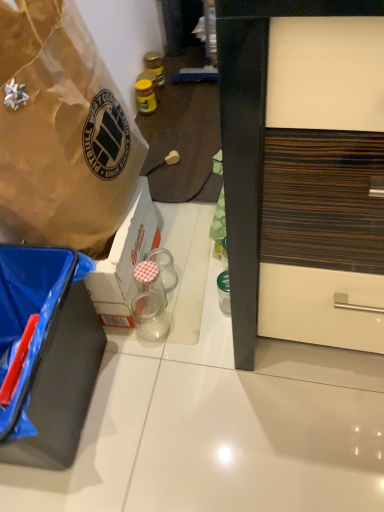
What do you see at coordinates (172, 158) in the screenshot? I see `matte plastic power outlet at center` at bounding box center [172, 158].

The image size is (384, 512). What do you see at coordinates (149, 279) in the screenshot?
I see `transparent glass jar at center, the third bottle from the back` at bounding box center [149, 279].

I want to click on black matte box at lower left, the first box in the bottom-to-top sequence, so coord(48,354).

How much space does transparent glass jar at center, which is the first coffee cup in bottom-to-top order, occupy vertically?

The height of transparent glass jar at center, which is the first coffee cup in bottom-to-top order, is 4.99 inches.

What do you see at coordinates (155, 66) in the screenshot? The height and width of the screenshot is (512, 384). I see `yellow glass jar at center, the 3th bottle ordered from the bottom` at bounding box center [155, 66].

The width and height of the screenshot is (384, 512). In order to click on yellow glass jar at upper center, which is the 2th bottle in top-to-bottom order in this screenshot , I will do `click(145, 96)`.

I want to click on the 2nd box positioned below the yellow glass jar at center, which is the first bottle from top to bottom (from the image's perspective), so click(48, 354).

Is yellow glass jar at center, the 3th bottle ordered from the bottom, further to camera compared to black matte box at lower left, the first box in the bottom-to-top sequence?

Yes, it is behind black matte box at lower left, the first box in the bottom-to-top sequence.

Would you say black matte box at lower left, arranged as the 2th box when viewed from the top, is part of yellow glass jar at center, the 3th bottle ordered from the bottom,'s contents?

No, black matte box at lower left, arranged as the 2th box when viewed from the top, is not a part of yellow glass jar at center, the 3th bottle ordered from the bottom.

Is point (80, 311) positioned before point (169, 165)?

Yes, point (80, 311) is closer to viewer.

From the image's perspective, is black matte box at lower left, the first box in the bottom-to-top sequence, above matte plastic power outlet at center?

No, from the image's perspective, black matte box at lower left, the first box in the bottom-to-top sequence, is not above matte plastic power outlet at center.

Which is more to the left, black matte box at lower left, the first box in the bottom-to-top sequence, or matte plastic power outlet at center?

black matte box at lower left, the first box in the bottom-to-top sequence, is more to the left.

Is black matte box at lower left, the first box in the bottom-to-top sequence, facing towards matte plastic power outlet at center?

No.

From the picture: Is black matte box at lower left, the first box in the bottom-to-top sequence, in front of or behind transparent glass jar at center, the 3th bottle from the top, in the image?

Clearly, black matte box at lower left, the first box in the bottom-to-top sequence, is in front of transparent glass jar at center, the 3th bottle from the top.

Is black matte box at lower left, the first box in the bottom-to-top sequence, facing towards transparent glass jar at center, acting as the 1th bottle starting from the front?

No.

Which bottle is the 1st one when counting from the back of the black matte box at lower left, the first box in the bottom-to-top sequence? Please provide its 2D coordinates.

[(149, 279)]

From the picture: How far apart are black matte box at lower left, arranged as the 2th box when viewed from the top, and transparent glass jar at center, which ranks as the first bottle in bottom-to-top order?

The distance of black matte box at lower left, arranged as the 2th box when viewed from the top, from transparent glass jar at center, which ranks as the first bottle in bottom-to-top order, is 12.21 inches.

From the picture: Does yellow glass jar at center, which is the first bottle from top to bottom, touch yellow glass jar at upper center, the 2th bottle in the front-to-back sequence?

yellow glass jar at center, which is the first bottle from top to bottom, and yellow glass jar at upper center, the 2th bottle in the front-to-back sequence, are clearly separated.

From the image's perspective, would you say yellow glass jar at center, arranged as the third bottle when viewed from the front, is shown under yellow glass jar at upper center, which ranks as the second bottle in bottom-to-top order?

No.

Can you confirm if yellow glass jar at center, which is the first bottle from top to bottom, is thinner than yellow glass jar at upper center, the second bottle in the back-to-front sequence?

Correct, the width of yellow glass jar at center, which is the first bottle from top to bottom, is less than that of yellow glass jar at upper center, the second bottle in the back-to-front sequence.

Is yellow glass jar at upper center, the second bottle in the back-to-front sequence, wider than black matte box at lower left, the first box in the bottom-to-top sequence?

Incorrect, the width of yellow glass jar at upper center, the second bottle in the back-to-front sequence, does not surpass that of black matte box at lower left, the first box in the bottom-to-top sequence.

Between yellow glass jar at upper center, the second bottle in the back-to-front sequence, and black matte box at lower left, the first box in the bottom-to-top sequence, which one is positioned in front?

black matte box at lower left, the first box in the bottom-to-top sequence, is more forward.

Does yellow glass jar at upper center, which is the 2th bottle in top-to-bottom order, contain black matte box at lower left, the first box in the bottom-to-top sequence?

Actually, black matte box at lower left, the first box in the bottom-to-top sequence, is outside yellow glass jar at upper center, which is the 2th bottle in top-to-bottom order.

From the image's perspective, between yellow glass jar at upper center, the 2th bottle in the front-to-back sequence, and black matte box at lower left, arranged as the 2th box when viewed from the top, who is located below?

black matte box at lower left, arranged as the 2th box when viewed from the top.

In the scene shown: From the image's perspective, is yellow glass jar at center, positioned as the 1th bottle in back-to-front order, beneath transparent glass jar at center, acting as the 1th bottle starting from the front?

No.

From a real-world perspective, which bottle is the 2nd one underneath the yellow glass jar at center, arranged as the third bottle when viewed from the front? Please provide its 2D coordinates.

[(149, 279)]

Is yellow glass jar at center, positioned as the 1th bottle in back-to-front order, positioned with its back to transparent glass jar at center, the third bottle from the back?

No.

From a real-world perspective, is yellow glass jar at center, which is the first bottle from top to bottom, over transparent glass jar at center, acting as the 1th bottle starting from the front?

Indeed, from a real-world perspective, yellow glass jar at center, which is the first bottle from top to bottom, stands above transparent glass jar at center, acting as the 1th bottle starting from the front.

Where is `box above the clear glass jar at center, which is the second coffee cup from bottom to top (from the image's perspective)`? box above the clear glass jar at center, which is the second coffee cup from bottom to top (from the image's perspective) is located at coordinates (62, 131).

Is clear glass jar at center, which is the second coffee cup from bottom to top, to the left of brown paper bag at upper left, which appears as the 1th box when viewed from the top, from the viewer's perspective?

No, clear glass jar at center, which is the second coffee cup from bottom to top, is not to the left of brown paper bag at upper left, which appears as the 1th box when viewed from the top.

In the scene shown: Which object is further away from the camera taking this photo, clear glass jar at center, which is the second coffee cup from bottom to top, or brown paper bag at upper left, the 2th box positioned from the bottom?

clear glass jar at center, which is the second coffee cup from bottom to top.

Considering the relative sizes of clear glass jar at center, which is the second coffee cup from bottom to top, and brown paper bag at upper left, which appears as the 1th box when viewed from the top, in the image provided, is clear glass jar at center, which is the second coffee cup from bottom to top, shorter than brown paper bag at upper left, which appears as the 1th box when viewed from the top,?

Correct, clear glass jar at center, which is the second coffee cup from bottom to top, is not as tall as brown paper bag at upper left, which appears as the 1th box when viewed from the top.

You are a GUI agent. You are given a task and a screenshot of the screen. Output one action in this format:
    pyautogui.click(x=<x>, y=<y>)
    Task: Click on the bottle that is the 3rd object located above the black matte box at lower left, the first box in the bottom-to-top sequence (from the image's perspective)
    This screenshot has width=384, height=512.
    Given the screenshot: What is the action you would take?
    pyautogui.click(x=155, y=66)

Identify the location of the 2nd box counting from the left of the matte plastic power outlet at center. This screenshot has height=512, width=384. (48, 354).

When comparing their distances from transparent glass jar at center, which ranks as the first bottle in bottom-to-top order, does yellow glass jar at center, the 3th bottle ordered from the bottom, or black matte box at lower left, the first box in the bottom-to-top sequence, seem further?

The object further to transparent glass jar at center, which ranks as the first bottle in bottom-to-top order, is yellow glass jar at center, the 3th bottle ordered from the bottom.

Estimate the real-world distances between objects in this image. Which object is closer to black matte box at lower left, the first box in the bottom-to-top sequence, transparent glass jar at center, which ranks as the first bottle in bottom-to-top order, or yellow glass jar at upper center, which is the 2th bottle in top-to-bottom order?

Based on the image, transparent glass jar at center, which ranks as the first bottle in bottom-to-top order, appears to be nearer to black matte box at lower left, the first box in the bottom-to-top sequence.

Which object lies nearer to the anchor point clear glass jar at center, arranged as the first coffee cup when viewed from the top, transparent glass jar at center, which ranks as the first bottle in bottom-to-top order, or yellow glass jar at upper center, the second bottle in the back-to-front sequence?

transparent glass jar at center, which ranks as the first bottle in bottom-to-top order.

Estimate the real-world distances between objects in this image. Which object is further from transparent glass jar at center, the 3th bottle from the top, yellow glass jar at upper center, the second bottle in the back-to-front sequence, or yellow glass jar at center, positioned as the 1th bottle in back-to-front order?

yellow glass jar at center, positioned as the 1th bottle in back-to-front order, is positioned further to the anchor transparent glass jar at center, the 3th bottle from the top.

From the picture: Estimate the real-world distances between objects in this image. Which object is closer to transparent glass jar at center, which is counted as the 2th coffee cup, starting from the top, yellow glass jar at center, the 3th bottle ordered from the bottom, or transparent glass jar at center, the 3th bottle from the top?

Among the two, transparent glass jar at center, the 3th bottle from the top, is located nearer to transparent glass jar at center, which is counted as the 2th coffee cup, starting from the top.

Estimate the real-world distances between objects in this image. Which object is closer to matte plastic power outlet at center, black matte box at lower left, the first box in the bottom-to-top sequence, or yellow glass jar at upper center, which ranks as the second bottle in bottom-to-top order?

Among the two, yellow glass jar at upper center, which ranks as the second bottle in bottom-to-top order, is located nearer to matte plastic power outlet at center.

Which object lies nearer to the anchor point transparent glass jar at center, the third bottle from the back, black matte box at lower left, the first box in the bottom-to-top sequence, or clear glass jar at center, which is the second coffee cup from bottom to top?

clear glass jar at center, which is the second coffee cup from bottom to top, lies closer to transparent glass jar at center, the third bottle from the back, than the other object.

From the image, which object appears to be nearer to black matte box at lower left, arranged as the 2th box when viewed from the top, yellow glass jar at upper center, which is the 2th bottle in top-to-bottom order, or transparent glass jar at center, which ranks as the first bottle in bottom-to-top order?

transparent glass jar at center, which ranks as the first bottle in bottom-to-top order, is positioned closer to the anchor black matte box at lower left, arranged as the 2th box when viewed from the top.

This screenshot has width=384, height=512. I want to click on box positioned between brown paper bag at upper left, which appears as the 1th box when viewed from the top, and clear glass jar at center, arranged as the first coffee cup when viewed from the top, from near to far, so click(x=48, y=354).

Locate an element on the screen. box positioned between brown paper bag at upper left, the 2th box positioned from the bottom, and matte plastic power outlet at center from near to far is located at coordinates (48, 354).

The height and width of the screenshot is (512, 384). Identify the location of coffee cup between brown paper bag at upper left, the 2th box positioned from the bottom, and transparent glass jar at center, which ranks as the first bottle in bottom-to-top order, from front to back. (150, 316).

The width and height of the screenshot is (384, 512). I want to click on power outlet between yellow glass jar at upper center, the second bottle in the back-to-front sequence, and clear glass jar at center, which is the second coffee cup from bottom to top, from top to bottom, so click(172, 158).